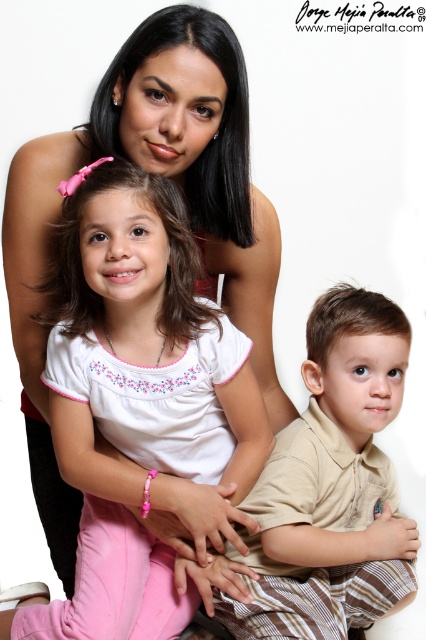
You are a photographer trying to capture a closeup shot of the white cotton shirt at center and the brown plaid pants at lower right. Given that your camera can only focus on objects within a 7 inch range, will you be able to capture both in focus?

The white cotton shirt at center and brown plaid pants at lower right are 8.07 inches apart from each other. Since the distance exceeds the camera focus range of 7 inches, you won t be able to capture both in focus.

In the scene shown: You are a photographer setting up a photo shoot. You need to place a small prop between the white cotton shirt at center and the brown plaid pants at lower right. Based on their positions, where should you place the prop?

The white cotton shirt at center is to the left of brown plaid pants at lower right, so you should place the prop between them on the right side of the white cotton shirt at center and the left side of the brown plaid pants at lower right.

Based on the scene description, which object is wider, the white cotton shirt at center or the brown plaid pants at lower right?

The white cotton shirt at center is wider than the brown plaid pants at lower right according to the description.